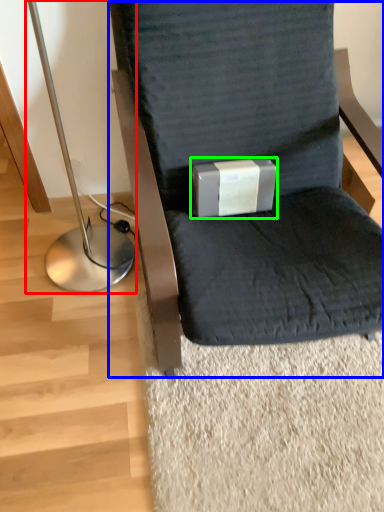
Question: Considering the real-world distances, which object is closest to bedside lamp (highlighted by a red box)? chair (highlighted by a blue box) or box (highlighted by a green box).

Choices:
 (A) chair
 (B) box

Answer: (B)